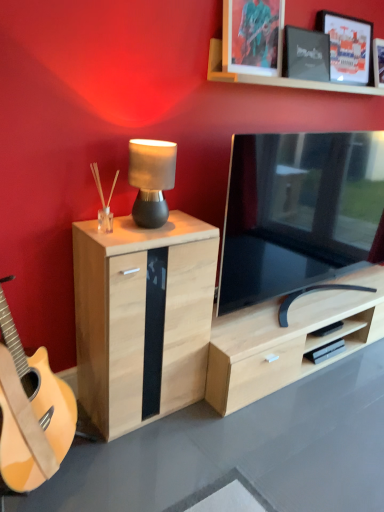
Find the location of `free space in front of matte black lamp at center`. free space in front of matte black lamp at center is located at coordinates (142, 233).